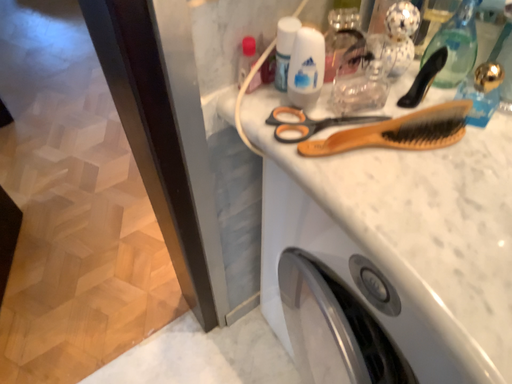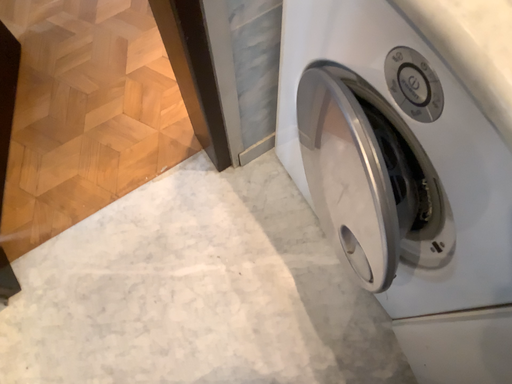
Question: Which way did the camera rotate in the video?

Choices:
 (A) rotated upward
 (B) rotated downward

Answer: (B)